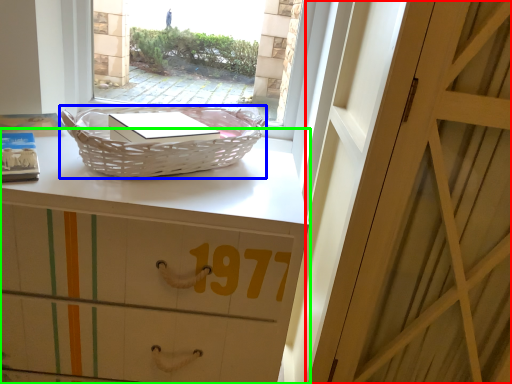
Question: Estimate the real-world distances between objects in this image. Which object is closer to door (highlighted by a red box), picnic basket (highlighted by a blue box) or desk (highlighted by a green box)?

Choices:
 (A) picnic basket
 (B) desk

Answer: (B)